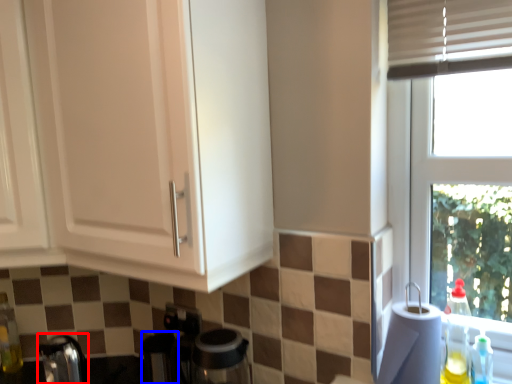
Question: Which object appears farthest to the camera in this image, faucet (highlighted by a red box) or appliance (highlighted by a blue box)?

Choices:
 (A) faucet
 (B) appliance

Answer: (B)